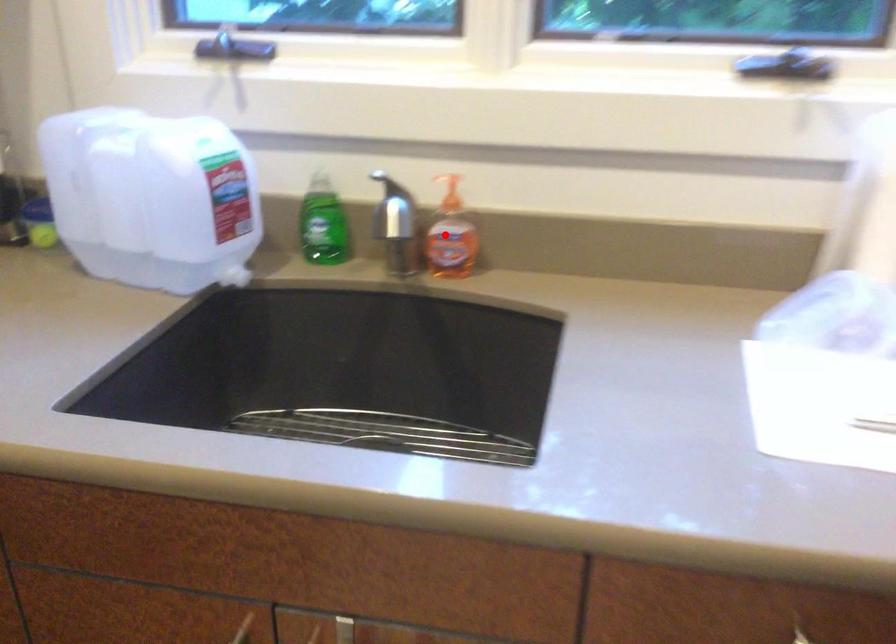
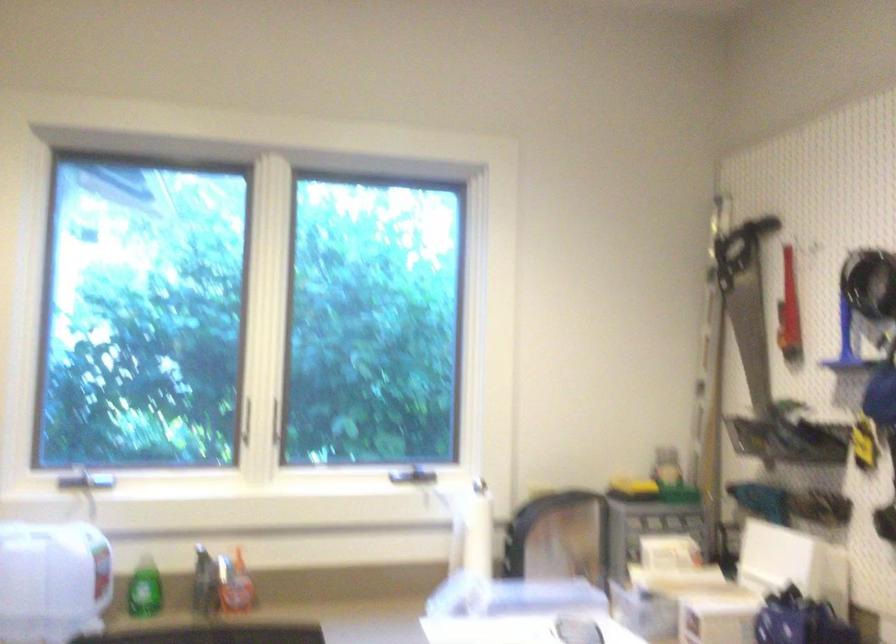
Question: I am providing you with two images of the same scene from different viewpoints. In image1, a red point is highlighted. Considering the same 3D point in image2, which of the following is correct?

Choices:
 (A) It is closer
 (B) It is farther

Answer: (B)